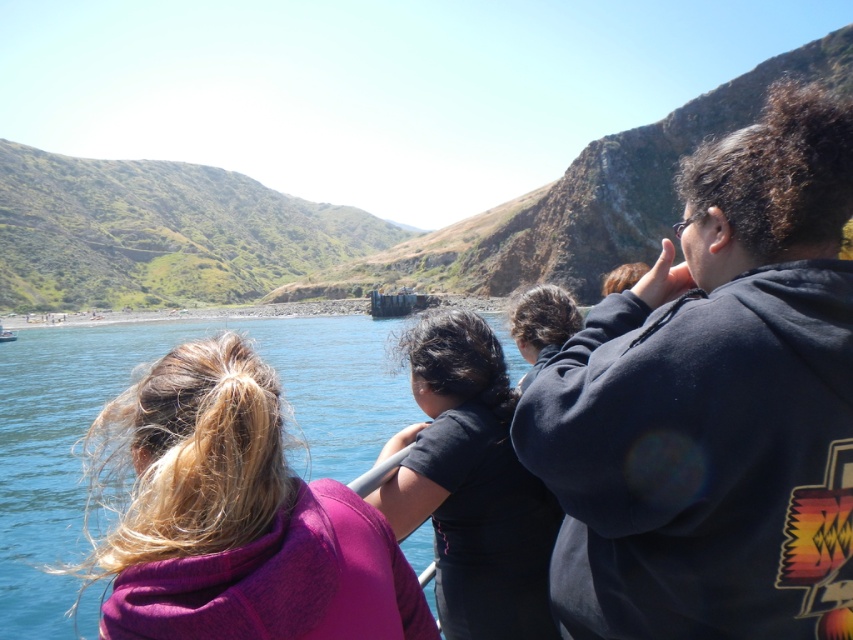
Is point (537, 557) closer to camera compared to point (525, 380)?

Yes, point (537, 557) is in front of point (525, 380).

Which is behind, point (509, 596) or point (544, 332)?

Point (544, 332)

Is point (477, 428) behind point (534, 353)?

No, (477, 428) is closer to viewer.

Find the location of `black matte shirt at center`. black matte shirt at center is located at coordinates (471, 484).

Is dark blue hoodie at upper right thinner than purple fleece jacket at center?

Incorrect, dark blue hoodie at upper right's width is not less than purple fleece jacket at center's.

What do you see at coordinates (715, 404) in the screenshot?
I see `dark blue hoodie at upper right` at bounding box center [715, 404].

The image size is (853, 640). Identify the location of dark blue hoodie at upper right. (715, 404).

Is purple fleece jacket at center thinner than dark brown hair at center?

No.

Which is above, purple fleece jacket at center or dark brown hair at center?

Positioned higher is dark brown hair at center.

Is point (399, 548) positioned before point (529, 356)?

Yes, it is.

Where is `purple fleece jacket at center`? The image size is (853, 640). purple fleece jacket at center is located at coordinates (234, 516).